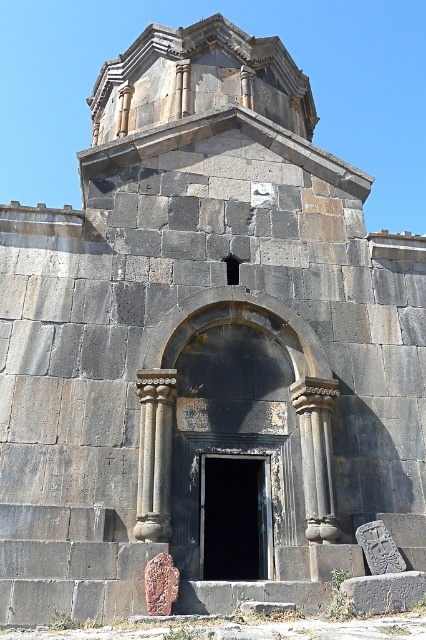
Question: Is black stone door at center bigger than black stone column at center?

Choices:
 (A) no
 (B) yes

Answer: (A)

Question: Where is black stone door at center located in relation to dark gray stone column at center in the image?

Choices:
 (A) below
 (B) above

Answer: (A)

Question: Is black stone door at center above dark gray stone column at center?

Choices:
 (A) no
 (B) yes

Answer: (A)

Question: Which object is the farthest from the black stone column at center?

Choices:
 (A) dark gray stone column at center
 (B) black stone door at center

Answer: (A)

Question: Which of the following is the closest to the observer?

Choices:
 (A) black stone door at center
 (B) dark gray stone column at center
 (C) black stone column at center

Answer: (C)

Question: Which point is closer to the camera?

Choices:
 (A) (215, 481)
 (B) (322, 460)
 (C) (144, 419)

Answer: (B)